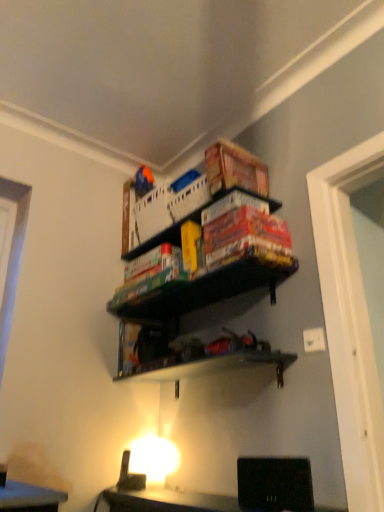
Question: Considering the relative sizes of white plastic crate at upper center and green matte board game at center in the image provided, is white plastic crate at upper center bigger than green matte board game at center?

Choices:
 (A) yes
 (B) no

Answer: (A)

Question: Is green matte board game at center surrounded by white plastic crate at upper center?

Choices:
 (A) no
 (B) yes

Answer: (A)

Question: Considering the relative positions of white plastic crate at upper center and green matte board game at center in the image provided, is white plastic crate at upper center to the left of green matte board game at center from the viewer's perspective?

Choices:
 (A) yes
 (B) no

Answer: (A)

Question: Is white plastic crate at upper center outside of green matte board game at center?

Choices:
 (A) no
 (B) yes

Answer: (B)

Question: Is white plastic crate at upper center thinner than green matte board game at center?

Choices:
 (A) yes
 (B) no

Answer: (A)

Question: From the image's perspective, would you say white plastic crate at upper center is positioned over green matte board game at center?

Choices:
 (A) no
 (B) yes

Answer: (B)

Question: Can you confirm if green matte board game at center is bigger than white plastic crate at upper center?

Choices:
 (A) yes
 (B) no

Answer: (B)

Question: Would you say green matte board game at center is outside white plastic crate at upper center?

Choices:
 (A) yes
 (B) no

Answer: (A)

Question: Does green matte board game at center turn towards white plastic crate at upper center?

Choices:
 (A) yes
 (B) no

Answer: (B)

Question: Is green matte board game at center further to camera compared to white plastic crate at upper center?

Choices:
 (A) no
 (B) yes

Answer: (A)

Question: Are green matte board game at center and white plastic crate at upper center far apart?

Choices:
 (A) yes
 (B) no

Answer: (B)

Question: From a real-world perspective, is green matte board game at center below white plastic crate at upper center?

Choices:
 (A) no
 (B) yes

Answer: (B)

Question: Which is correct: white plastic crate at upper center is inside green matte board game at center, or outside of it?

Choices:
 (A) outside
 (B) inside

Answer: (A)